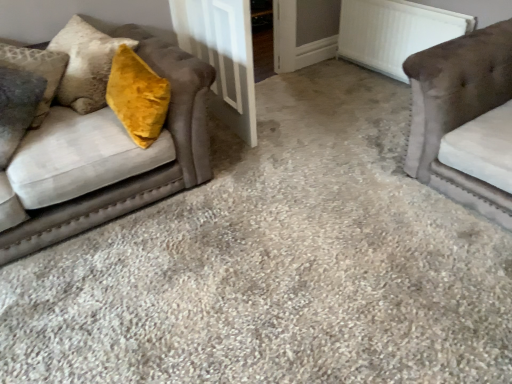
Question: Does white textured radiator at upper right contain white wood door at center?

Choices:
 (A) no
 (B) yes

Answer: (A)

Question: Is white textured radiator at upper right not within white wood door at center?

Choices:
 (A) yes
 (B) no

Answer: (A)

Question: Is white textured radiator at upper right positioned before white wood door at center?

Choices:
 (A) no
 (B) yes

Answer: (A)

Question: Does white textured radiator at upper right turn towards white wood door at center?

Choices:
 (A) yes
 (B) no

Answer: (A)

Question: Is there a large distance between white textured radiator at upper right and white wood door at center?

Choices:
 (A) yes
 (B) no

Answer: (A)

Question: Is white textured radiator at upper right beside white wood door at center?

Choices:
 (A) yes
 (B) no

Answer: (B)

Question: Would you say white wood door at center contains velvet brown couch at left, which is the 2th studio couch in right-to-left order?

Choices:
 (A) no
 (B) yes

Answer: (A)

Question: Is white wood door at center to the right of velvet brown couch at left, which is the 2th studio couch in right-to-left order, from the viewer's perspective?

Choices:
 (A) no
 (B) yes

Answer: (B)

Question: Is white wood door at center outside of velvet brown couch at left, placed as the first studio couch when sorted from left to right?

Choices:
 (A) yes
 (B) no

Answer: (A)

Question: Are white wood door at center and velvet brown couch at left, placed as the first studio couch when sorted from left to right, beside each other?

Choices:
 (A) yes
 (B) no

Answer: (B)

Question: Considering the relative sizes of white wood door at center and velvet brown couch at left, placed as the first studio couch when sorted from left to right, in the image provided, is white wood door at center taller than velvet brown couch at left, placed as the first studio couch when sorted from left to right,?

Choices:
 (A) no
 (B) yes

Answer: (B)

Question: From a real-world perspective, is white wood door at center positioned over velvet brown couch at left, which is the 2th studio couch in right-to-left order, based on gravity?

Choices:
 (A) yes
 (B) no

Answer: (A)

Question: From a real-world perspective, is white textured radiator at upper right on top of velvet brown couch at left, which is the 2th studio couch in right-to-left order?

Choices:
 (A) yes
 (B) no

Answer: (B)